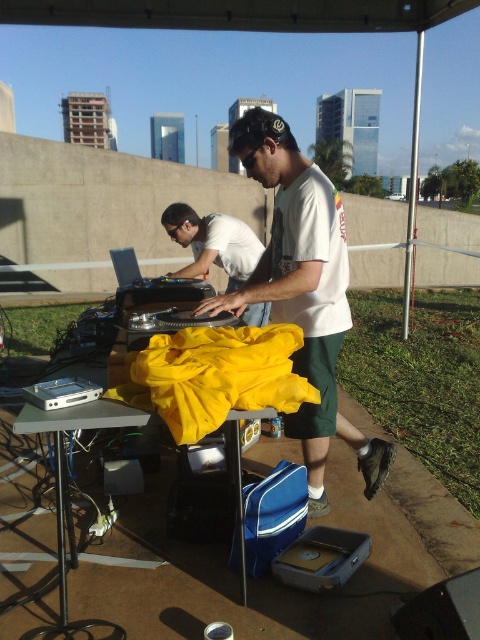
You are standing at the DJ table in the center of the image. There are two points marked in the scene, one at coordinates point (322, 508) and another at point (172, 212). Which point is closer to your current position?

Point (322, 508) is closer to your current position at the DJ table because it is in front of point (172, 212).